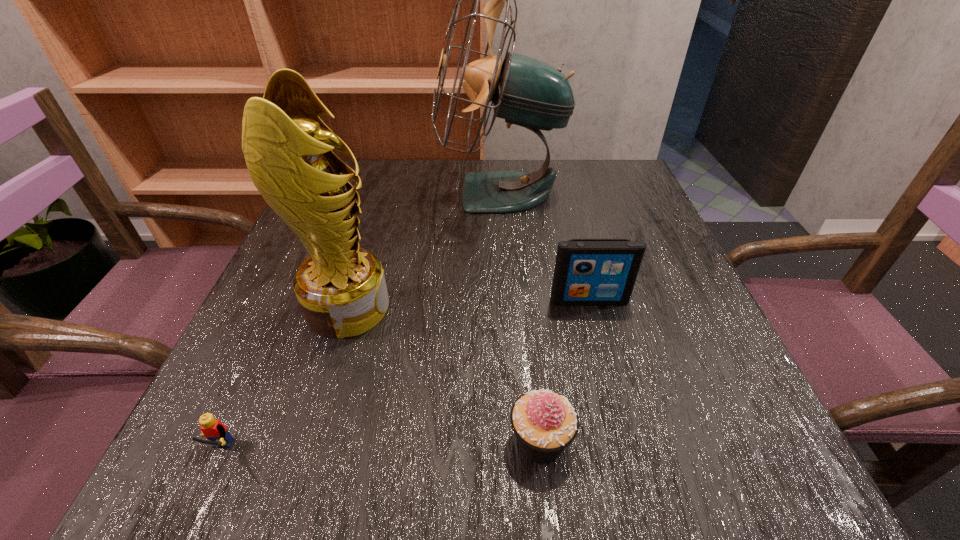
Locate an element on the screen. the farthest object is located at coordinates (527, 92).

This screenshot has height=540, width=960. I want to click on the fourth object from right to left, so click(x=341, y=288).

Where is `the third shortest object`? Image resolution: width=960 pixels, height=540 pixels. the third shortest object is located at coordinates (587, 271).

Identify the location of the fourth tallest object. The image size is (960, 540). (544, 422).

Where is `the shortest object`? the shortest object is located at coordinates (214, 430).

Locate an element on the screen. the leftmost object is located at coordinates (214, 430).

You are a GUI agent. You are given a task and a screenshot of the screen. Output one action in this format:
    pyautogui.click(x=<x>, y=<y>)
    Task: Click on the vacant area situated 0.210m on the front-facing side of the fan for air flow
    Image resolution: width=960 pixels, height=540 pixels.
    Given the screenshot: What is the action you would take?
    pyautogui.click(x=349, y=193)

At what (x,y) coordinates should I click in order to perform the action: click on vacant space situated 0.240m on the front-facing side of the fan for air flow. Please return your answer as a coordinate pair (x, y). Looking at the image, I should click on (337, 193).

Identify the location of blank area located on the front-facing side of the fan for air flow. (363, 193).

Locate an element on the screen. This screenshot has width=960, height=540. vacant area situated on the front-facing side of the award is located at coordinates (554, 308).